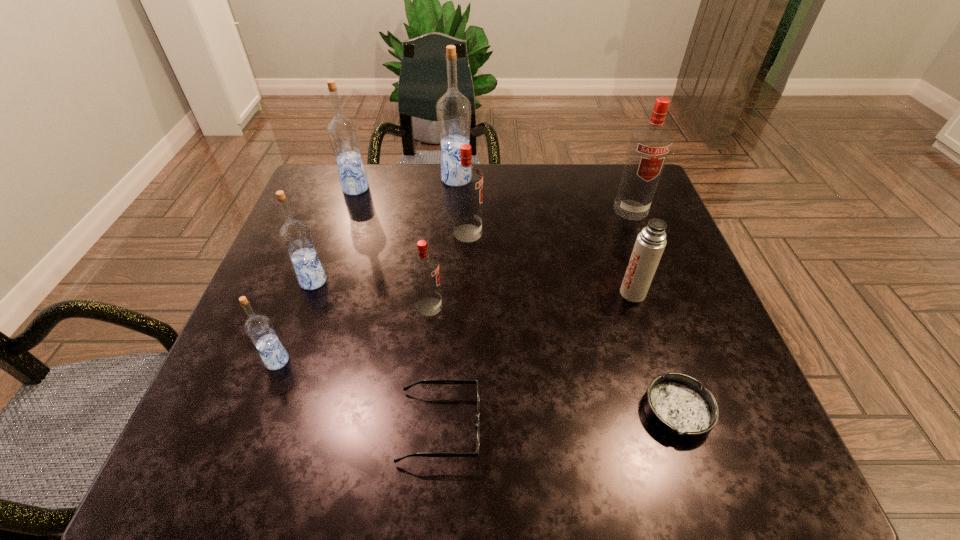
Where is `vacant region located 0.300m on the front label of the third farthest object`? vacant region located 0.300m on the front label of the third farthest object is located at coordinates (670, 311).

At what (x,y) coordinates should I click in order to perform the action: click on vacant space located on the front label of the second nearest red vodka. Please return your answer as a coordinate pair (x, y). Looking at the image, I should click on (555, 233).

This screenshot has width=960, height=540. I want to click on blank area located on the right of the second smallest blue vodka, so click(x=380, y=281).

You are a GUI agent. You are given a task and a screenshot of the screen. Output one action in this format:
    pyautogui.click(x=<x>, y=<y>)
    Task: Click on the vacant space located on the front of the thermos bottle
    The height and width of the screenshot is (540, 960).
    Given the screenshot: What is the action you would take?
    pyautogui.click(x=678, y=433)

Where is `free space located on the front label of the sixth farthest vodka`? The image size is (960, 540). free space located on the front label of the sixth farthest vodka is located at coordinates pos(490,307).

Identify the location of vacant space located on the back of the nearest blue vodka. This screenshot has width=960, height=540. (323, 239).

Identify the location of vacant space located at the front lenses of the black sunglasses. This screenshot has height=540, width=960. point(627,427).

You are a GUI agent. You are given a task and a screenshot of the screen. Output one action in this format:
    pyautogui.click(x=<x>, y=<y>)
    Task: Click on the free space located on the back of the ashtray
    
    Given the screenshot: What is the action you would take?
    [x=635, y=283]

Identify the location of sunglasses located in the near edge section of the desktop. This screenshot has height=540, width=960. (441, 382).

You are a GUI agent. You are given a task and a screenshot of the screen. Output one action in this format:
    pyautogui.click(x=<x>, y=<y>)
    Task: Click on the ashtray located at the near edge
    This screenshot has height=540, width=960.
    Given the screenshot: What is the action you would take?
    pyautogui.click(x=676, y=404)